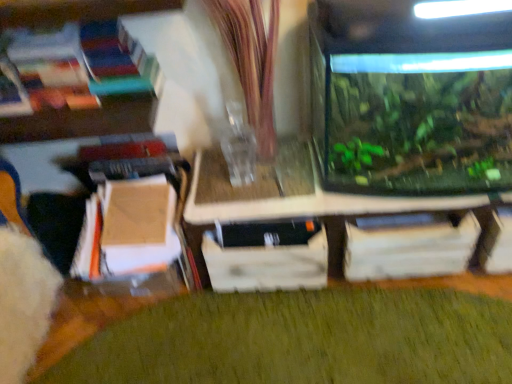
What are the coordinates of `free region under green matte plant at lower center (from a real-world perspective)` in the screenshot? It's located at click(x=279, y=324).